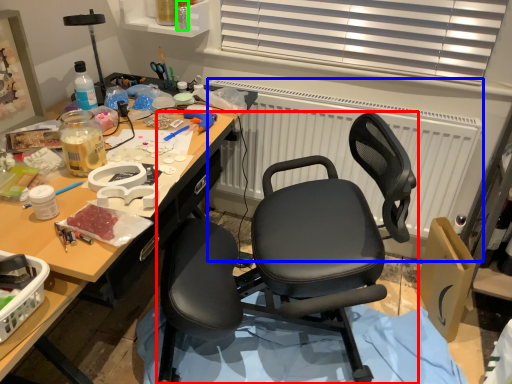
Question: Which object is positioned closest to chair (highlighted by a red box)? Select from radiator (highlighted by a blue box) and bottle (highlighted by a green box).

Choices:
 (A) radiator
 (B) bottle

Answer: (A)